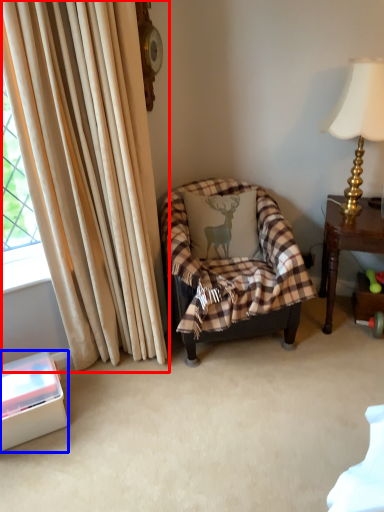
Question: Among these objects, which one is farthest to the camera, curtain (highlighted by a red box) or box (highlighted by a blue box)?

Choices:
 (A) curtain
 (B) box

Answer: (B)